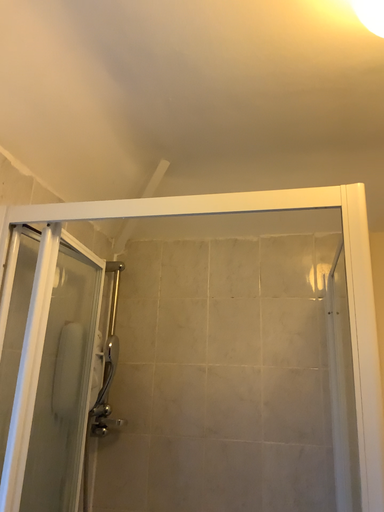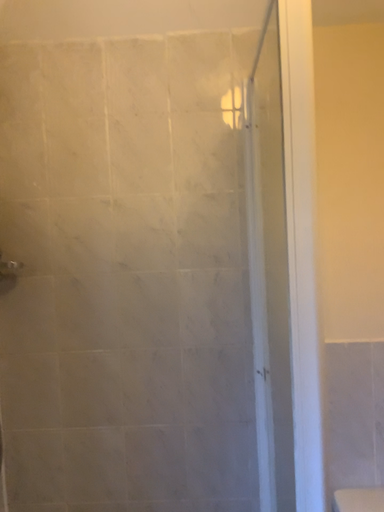
Question: How did the camera likely rotate when shooting the video?

Choices:
 (A) rotated downward
 (B) rotated upward

Answer: (A)